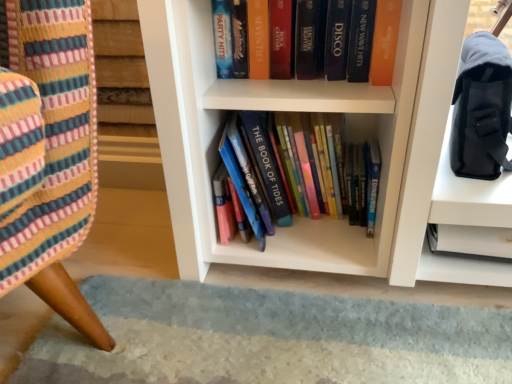
Question: From the image's perspective, is orange matte book at upper center, which is counted as the first book, starting from the top, positioned above or below hardcover books at center, which is the 1th book in bottom-to-top order?

Choices:
 (A) above
 (B) below

Answer: (A)

Question: Considering their positions, is orange matte book at upper center, which is counted as the first book, starting from the top, located in front of or behind hardcover books at center, the second book in the top-to-bottom sequence?

Choices:
 (A) behind
 (B) front

Answer: (A)

Question: Estimate the real-world distances between objects in this image. Which object is farther from the black fabric shoulder bag at upper right?

Choices:
 (A) hardcover books at center, the second book in the top-to-bottom sequence
 (B) orange matte book at upper center, acting as the 2th book starting from the bottom

Answer: (A)

Question: Which object is the closest to the black fabric shoulder bag at upper right?

Choices:
 (A) orange matte book at upper center, which is counted as the first book, starting from the top
 (B) hardcover books at center, the second book in the top-to-bottom sequence

Answer: (A)